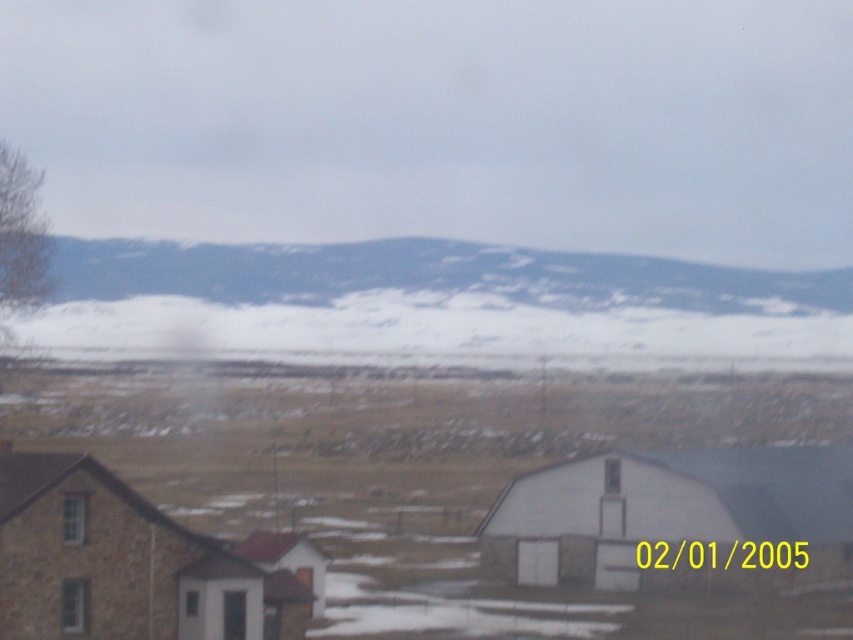
You are standing in the rural winter landscape and want to take a photo of the brown stone barn at lower left and the snowy mountain at upper center. Which object will appear larger in the photo if you frame both in your camera?

The brown stone barn at lower left will appear larger in the photo because it is closer to you than the snowy mountain at upper center, which is farther away and thus smaller in the frame.

You are standing in the rural winter landscape and want to place a small flag at the point closer to you between the two points marked as point (526, 580) and point (6, 632). Which point should you choose?

You should choose point (6, 632) because it is closer to you than point (526, 580).